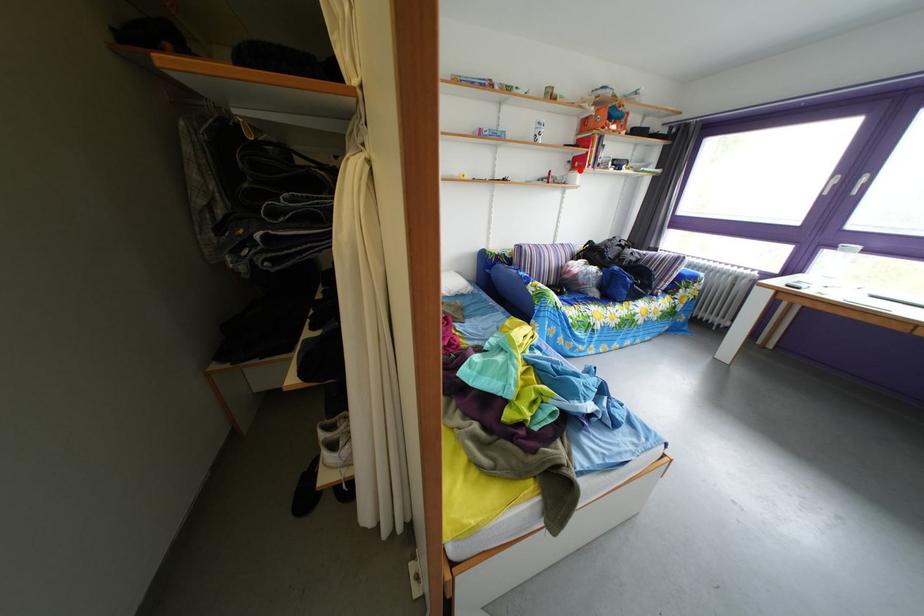
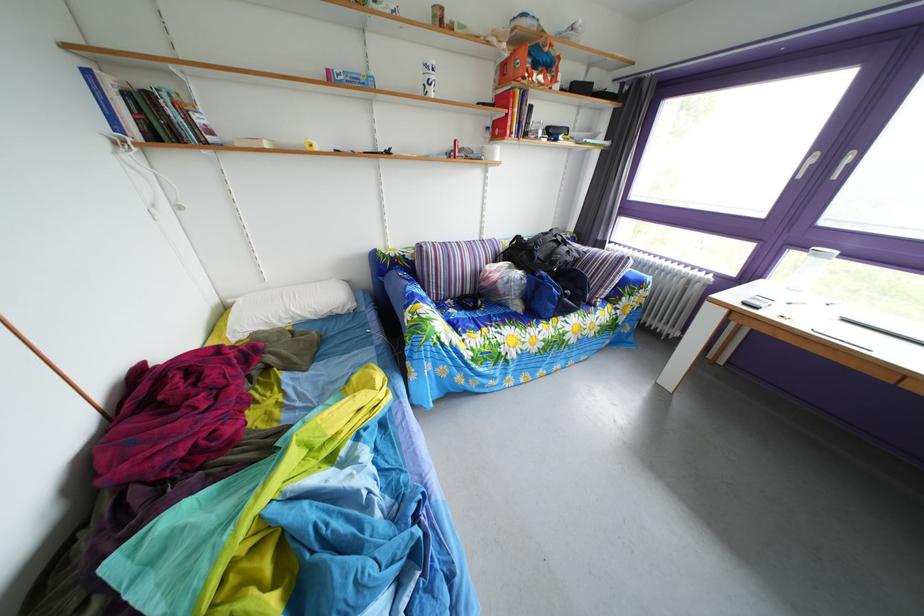
Find the pixel in the second image that matches the highlighted location in the first image.

(499, 137)